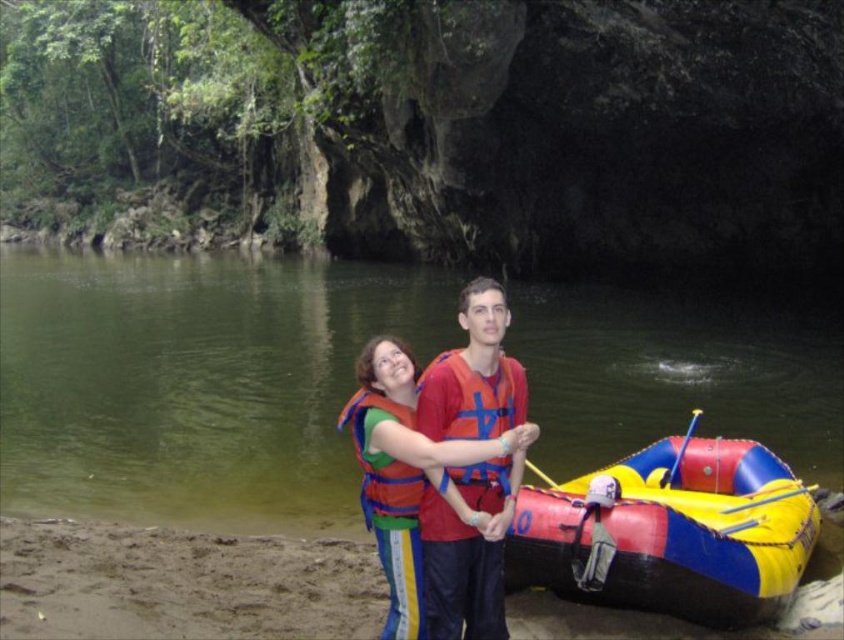
Question: Which object appears farthest from the camera in this image?

Choices:
 (A) matte orange life jacket at center
 (B) matte orange life vest at center
 (C) green rubber raft at center

Answer: (C)

Question: Is green rubber raft at center above matte orange life jacket at center?

Choices:
 (A) no
 (B) yes

Answer: (B)

Question: Which of the following is the closest to the observer?

Choices:
 (A) (456, 371)
 (B) (410, 424)
 (C) (698, 564)
 (D) (296, 440)

Answer: (B)

Question: Does orange life jacket at center appear on the right side of matte orange life jacket at center?

Choices:
 (A) yes
 (B) no

Answer: (A)

Question: Which object is farther from the camera taking this photo?

Choices:
 (A) matte orange life jacket at center
 (B) matte orange life vest at center

Answer: (B)

Question: Can you confirm if rubberized inflatable raft at lower right is positioned to the left of matte orange life jacket at center?

Choices:
 (A) no
 (B) yes

Answer: (A)